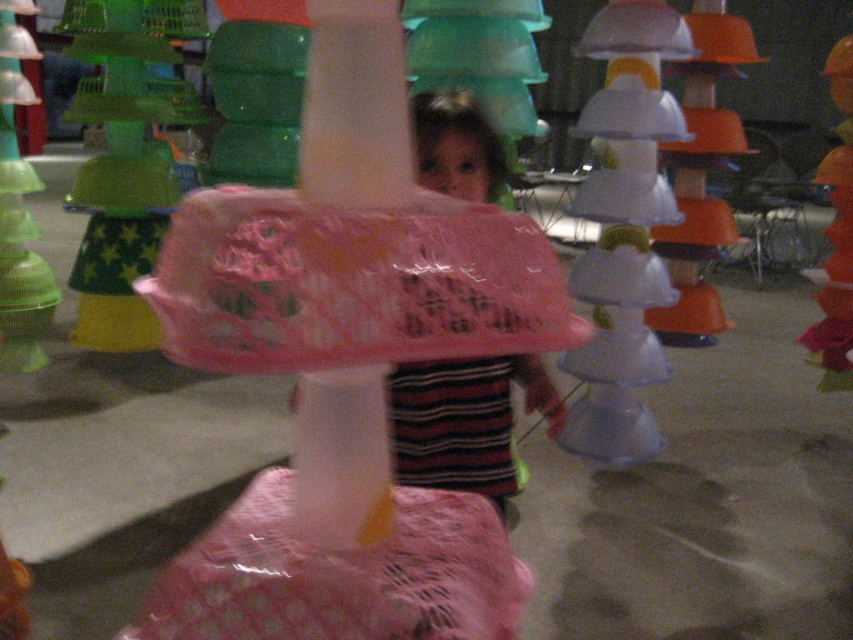
Question: Can you confirm if green translucent cups at center is thinner than orange matte toy at right?

Choices:
 (A) no
 (B) yes

Answer: (A)

Question: Which of the following is the farthest from the observer?

Choices:
 (A) translucent green plastic cups at upper left
 (B) green translucent cups at center
 (C) pink lace umbrella at center

Answer: (A)

Question: Which object appears closest to the camera in this image?

Choices:
 (A) orange matte plastic bowl at upper right
 (B) pink lace umbrella at center
 (C) orange matte toy at right

Answer: (C)

Question: Can you confirm if translucent white mushroom at center is wider than pink plastic bag at center?

Choices:
 (A) yes
 (B) no

Answer: (A)

Question: Is pink lace umbrella at center further to the viewer compared to translucent green plastic cups at upper left?

Choices:
 (A) no
 (B) yes

Answer: (A)

Question: Which point is farther to the camera?

Choices:
 (A) (467, 144)
 (B) (833, 330)

Answer: (B)